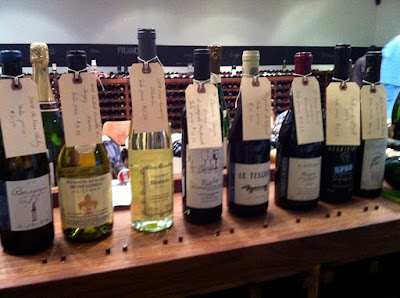
Where is `clear wine bottle`? Image resolution: width=400 pixels, height=298 pixels. clear wine bottle is located at coordinates (140, 135), (156, 225).